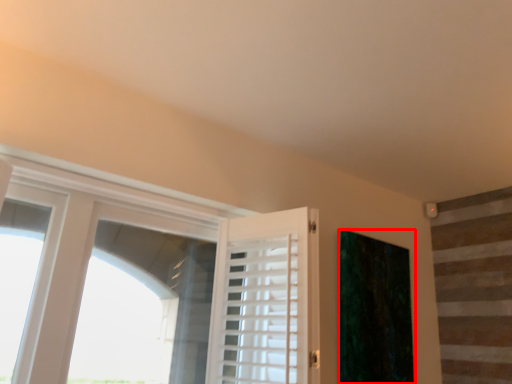
Question: From the image's perspective, what is the correct spatial relationship of curtain (annotated by the red box) in relation to barn door?

Choices:
 (A) above
 (B) below

Answer: (B)